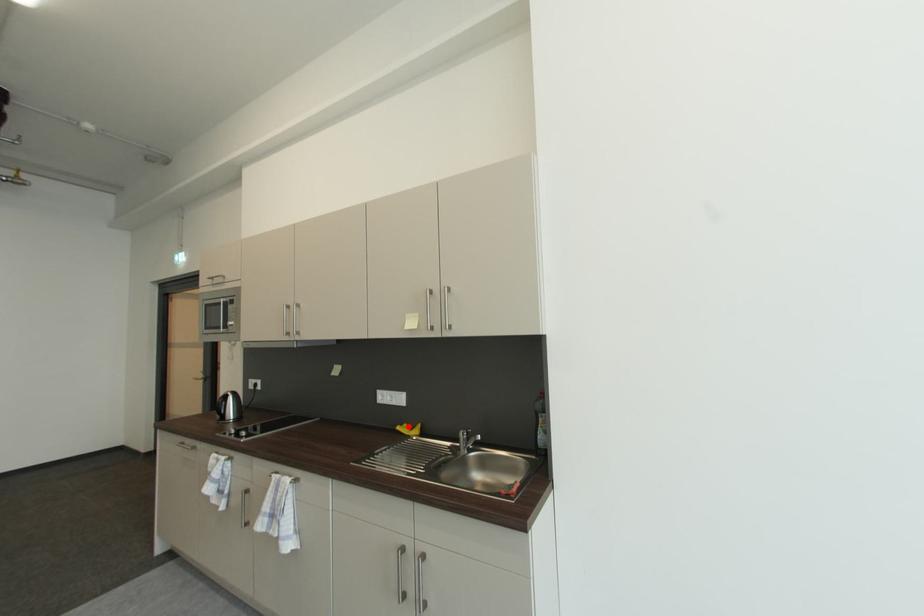
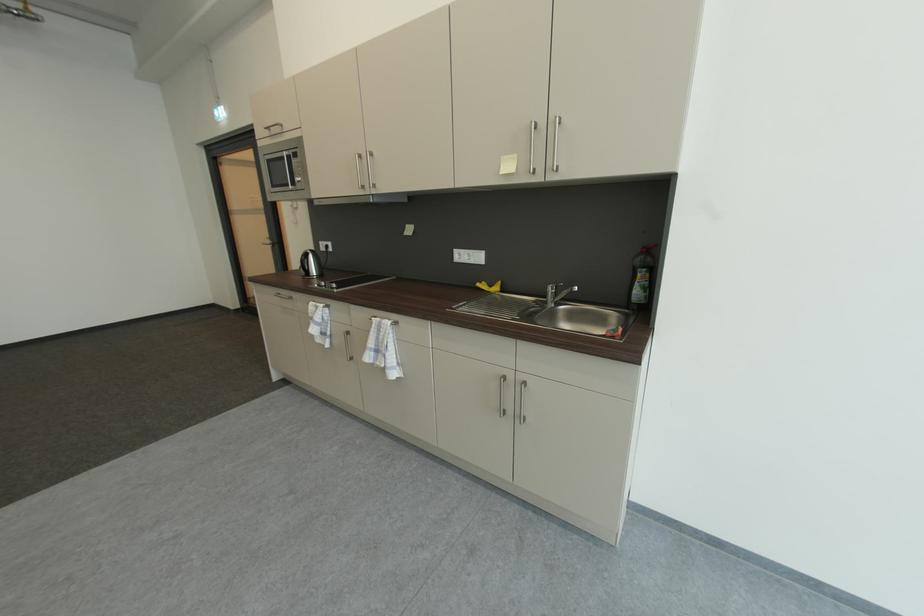
Question: I am providing you with two images of the same scene from different viewpoints. Image1 has a red point marked. In image2, the corresponding 3D location appears at what relative position? Reply with the corresponding letter.

Choices:
 (A) Closer
 (B) Farther

Answer: (A)